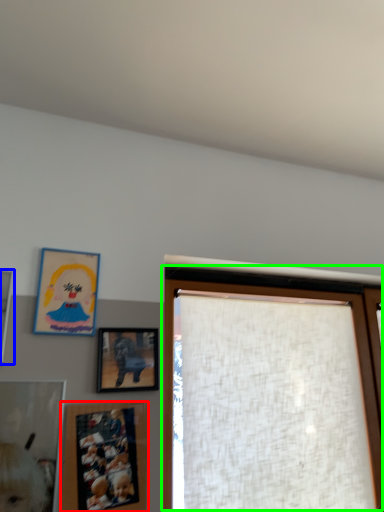
Question: Considering the real-world distances, which object is farthest from picture frame (highlighted by a red box)? picture frame (highlighted by a blue box) or window (highlighted by a green box)?

Choices:
 (A) picture frame
 (B) window

Answer: (A)